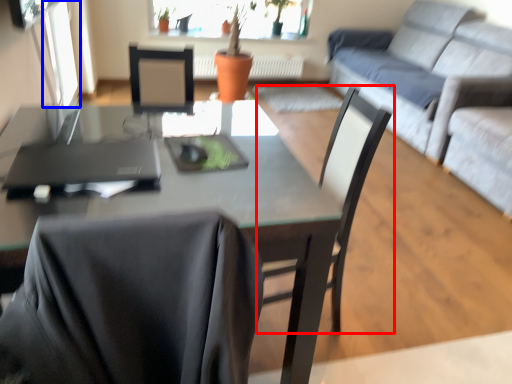
Question: Which point is closer to the camera, chair (highlighted by a red box) or window screen (highlighted by a blue box)?

Choices:
 (A) chair
 (B) window screen

Answer: (A)